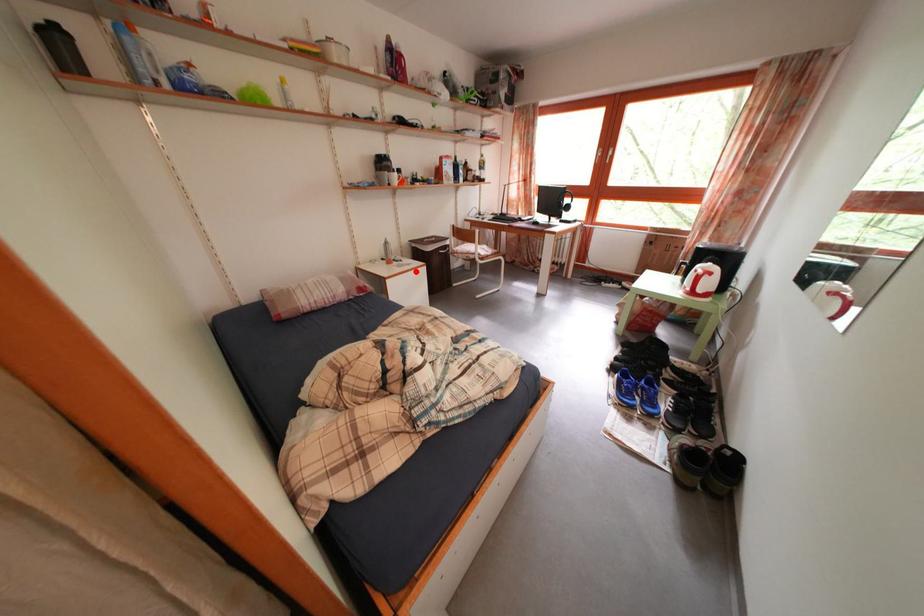
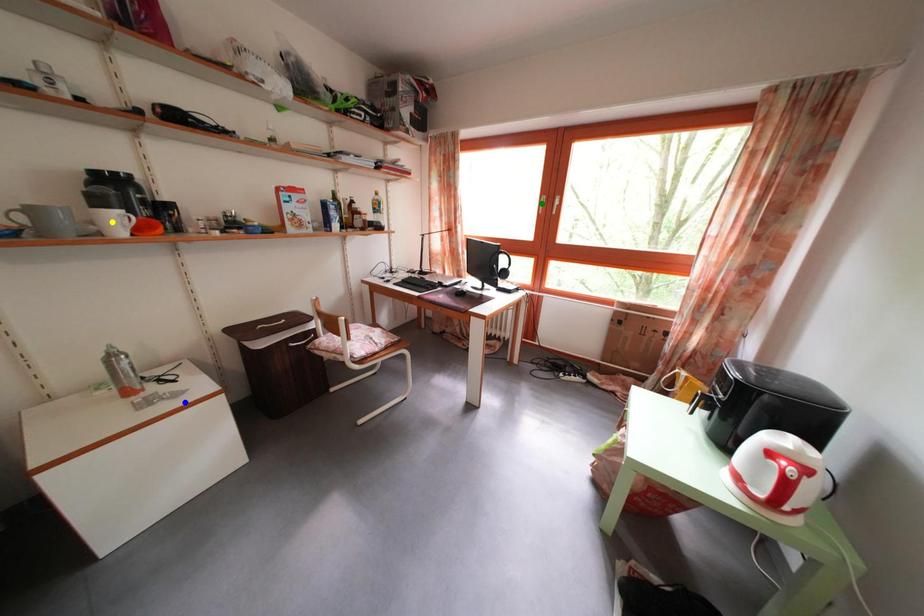
Question: I am providing you with two images of the same scene from different viewpoints. A red point is marked on the first image. You are given multiple points on the second image. Which point in image 2 is actually the same real-world point as the red point in image 1?

Choices:
 (A) yellow point
 (B) green point
 (C) blue point

Answer: (C)